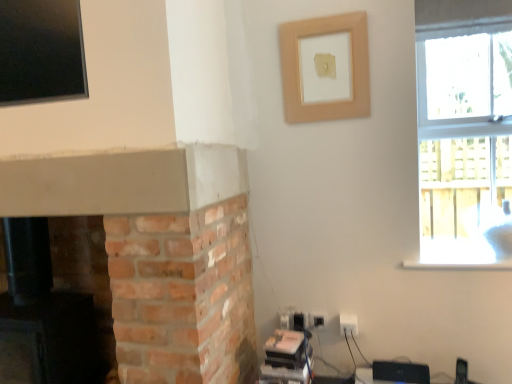
Question: Is wooden frame at upper center to the left of clear glass window at upper right from the viewer's perspective?

Choices:
 (A) yes
 (B) no

Answer: (A)

Question: Can you confirm if wooden frame at upper center is thinner than clear glass window at upper right?

Choices:
 (A) yes
 (B) no

Answer: (A)

Question: Is wooden frame at upper center directly adjacent to clear glass window at upper right?

Choices:
 (A) yes
 (B) no

Answer: (B)

Question: From the image's perspective, is wooden frame at upper center beneath clear glass window at upper right?

Choices:
 (A) yes
 (B) no

Answer: (B)

Question: From the image's perspective, is wooden frame at upper center located above clear glass window at upper right?

Choices:
 (A) yes
 (B) no

Answer: (A)

Question: Is wooden frame at upper center taller than clear glass window at upper right?

Choices:
 (A) yes
 (B) no

Answer: (B)

Question: Considering the relative sizes of brick fireplace at lower left and white plastic electric outlet at lower right in the image provided, is brick fireplace at lower left smaller than white plastic electric outlet at lower right?

Choices:
 (A) yes
 (B) no

Answer: (B)

Question: Is brick fireplace at lower left turned away from white plastic electric outlet at lower right?

Choices:
 (A) no
 (B) yes

Answer: (A)

Question: Can you confirm if brick fireplace at lower left is positioned to the right of white plastic electric outlet at lower right?

Choices:
 (A) yes
 (B) no

Answer: (B)

Question: Considering the relative sizes of brick fireplace at lower left and white plastic electric outlet at lower right in the image provided, is brick fireplace at lower left bigger than white plastic electric outlet at lower right?

Choices:
 (A) no
 (B) yes

Answer: (B)

Question: Is brick fireplace at lower left wider than white plastic electric outlet at lower right?

Choices:
 (A) no
 (B) yes

Answer: (B)

Question: Is brick fireplace at lower left closer to the viewer compared to white plastic electric outlet at lower right?

Choices:
 (A) yes
 (B) no

Answer: (A)

Question: Does clear glass window at upper right lie in front of white plastic electric outlet at lower right?

Choices:
 (A) yes
 (B) no

Answer: (A)